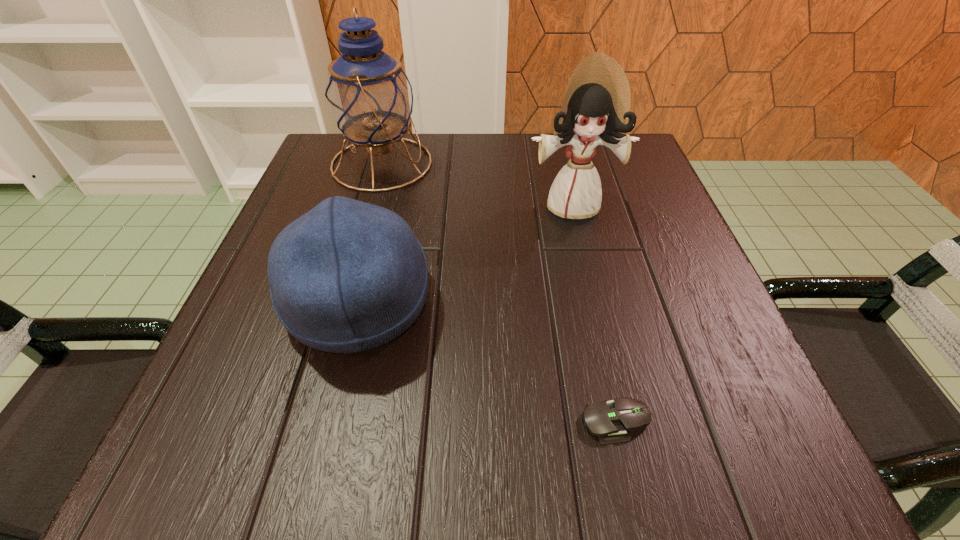
Image resolution: width=960 pixels, height=540 pixels. Find the location of `free spot that satisfies the following two spatial constraints: 1. on the front-facing side of the second nearest object; 2. on the left side of the lantern`. free spot that satisfies the following two spatial constraints: 1. on the front-facing side of the second nearest object; 2. on the left side of the lantern is located at coordinates (343, 302).

Image resolution: width=960 pixels, height=540 pixels. Find the location of `free region that satisfies the following two spatial constraints: 1. on the front-facing side of the lantern; 2. on the left side of the nearest object`. free region that satisfies the following two spatial constraints: 1. on the front-facing side of the lantern; 2. on the left side of the nearest object is located at coordinates (308, 421).

The height and width of the screenshot is (540, 960). In order to click on blank space that satisfies the following two spatial constraints: 1. on the back side of the nearest object; 2. on the front-facing side of the lantern in this screenshot , I will do `click(558, 164)`.

Identify the location of vacant space that satisfies the following two spatial constraints: 1. on the front-facing side of the computer mouse; 2. on the right side of the lantern. This screenshot has width=960, height=540. (308, 421).

What are the coordinates of `free space that satisfies the following two spatial constraints: 1. on the back side of the computer mouse; 2. on the front-facing side of the lantern` in the screenshot? It's located at (558, 164).